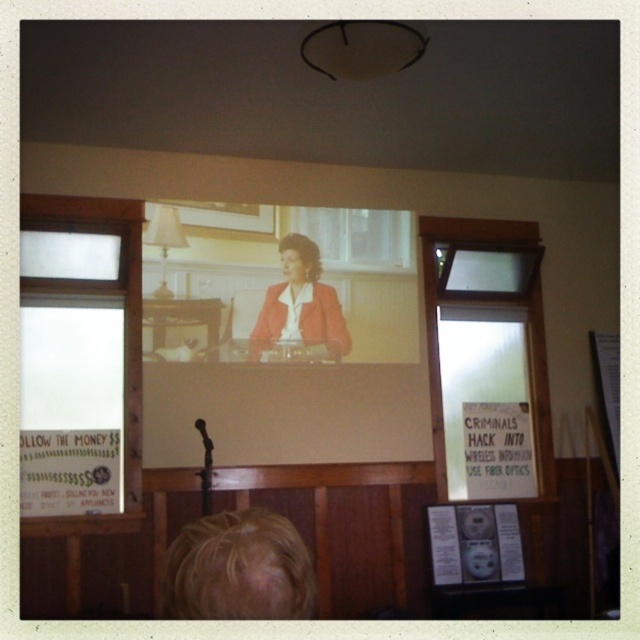
Which is in front, point (221, 582) or point (289, 316)?

Point (221, 582)

Describe the element at coordinates (237, 570) in the screenshot. I see `blonde hair at lower left` at that location.

Locate an element on the screen. The width and height of the screenshot is (640, 640). blonde hair at lower left is located at coordinates (237, 570).

Where is `blonde hair at lower left`? Image resolution: width=640 pixels, height=640 pixels. blonde hair at lower left is located at coordinates (237, 570).